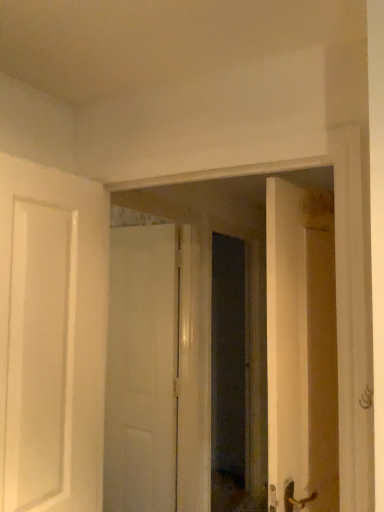
Question: From the image's perspective, is transparent glass door at center positioned above or below white matte door at center?

Choices:
 (A) above
 (B) below

Answer: (A)

Question: Considering the positions of transparent glass door at center and white matte door at center in the image, is transparent glass door at center bigger or smaller than white matte door at center?

Choices:
 (A) big
 (B) small

Answer: (A)

Question: Considering the positions of transparent glass door at center and white matte door at center in the image, is transparent glass door at center taller or shorter than white matte door at center?

Choices:
 (A) tall
 (B) short

Answer: (B)

Question: Is white matte door at center wider or thinner than transparent glass door at center?

Choices:
 (A) thin
 (B) wide

Answer: (A)

Question: In terms of height, does white matte door at center look taller or shorter compared to transparent glass door at center?

Choices:
 (A) tall
 (B) short

Answer: (A)

Question: From the image's perspective, is white matte door at center above or below transparent glass door at center?

Choices:
 (A) below
 (B) above

Answer: (A)

Question: From a real-world perspective, is white matte door at center physically located above or below transparent glass door at center?

Choices:
 (A) above
 (B) below

Answer: (B)